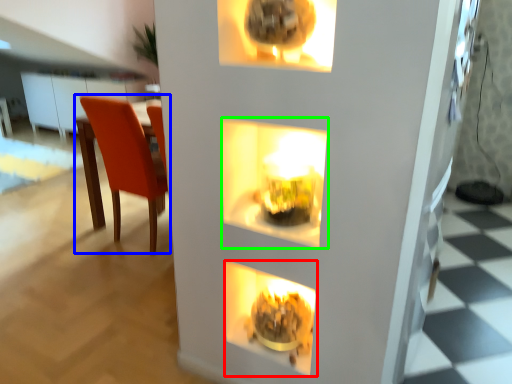
Question: Considering the real-world distances, which object is farthest from fireplace (highlighted by a red box)? chair (highlighted by a blue box) or shelf (highlighted by a green box)?

Choices:
 (A) chair
 (B) shelf

Answer: (A)